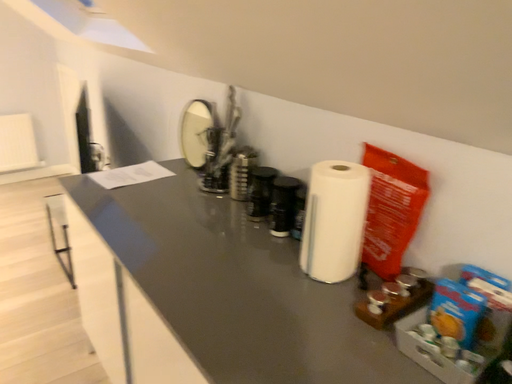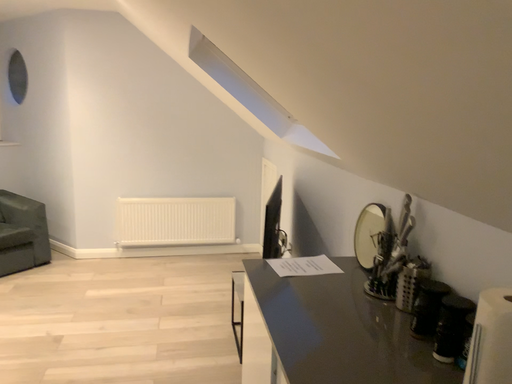
Question: How did the camera likely rotate when shooting the video?

Choices:
 (A) rotated upward
 (B) rotated downward

Answer: (A)